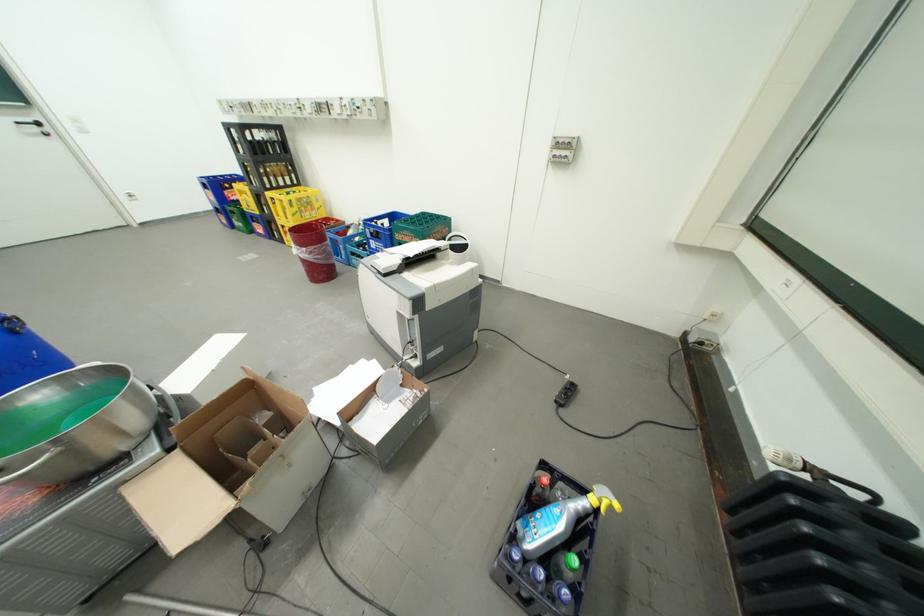
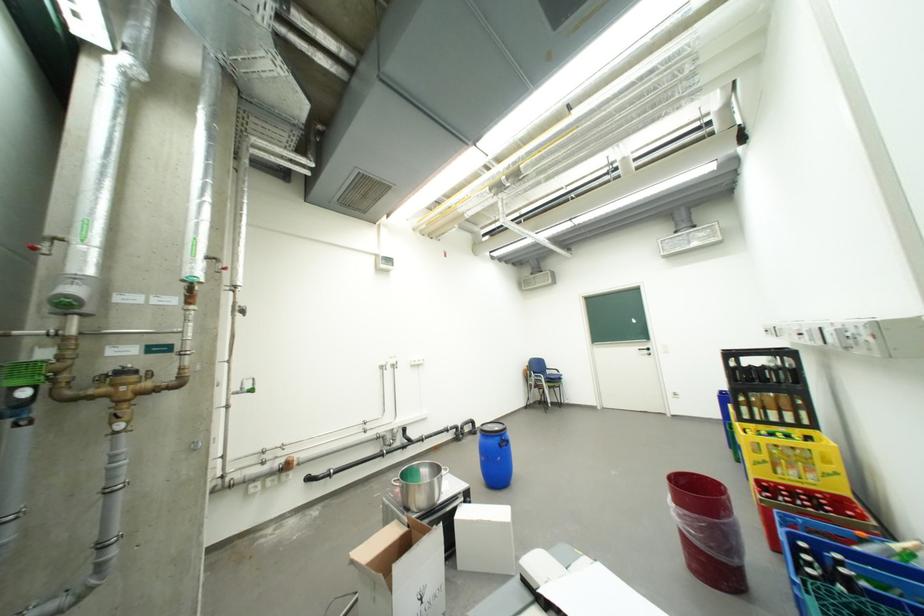
Find the pixel in the second image that matches the point at 29,124 in the first image.

(650, 351)